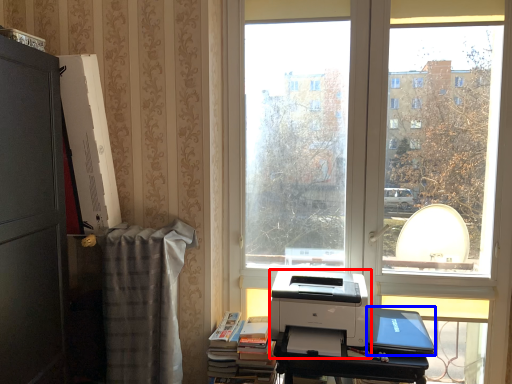
Question: Among these objects, which one is farthest to the camera, printer (highlighted by a red box) or laptop (highlighted by a blue box)?

Choices:
 (A) printer
 (B) laptop

Answer: (B)